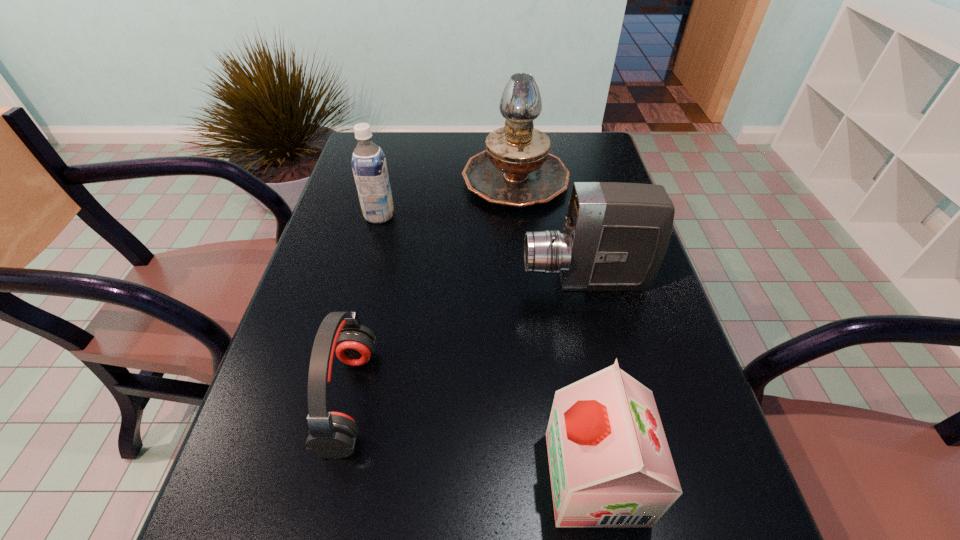
The height and width of the screenshot is (540, 960). In order to click on oil lamp in this screenshot , I will do `click(516, 170)`.

Find the location of `the farther soya milk`. the farther soya milk is located at coordinates (368, 161).

At what (x,y) coordinates should I click in order to perform the action: click on camcorder. Please return your answer as a coordinate pair (x, y). The width and height of the screenshot is (960, 540). Looking at the image, I should click on (615, 236).

The image size is (960, 540). In order to click on the right soya milk in this screenshot , I will do [610, 465].

Locate an element on the screen. This screenshot has width=960, height=540. earphone is located at coordinates (332, 435).

The width and height of the screenshot is (960, 540). Identify the location of blank area located on the front of the oil lamp. (529, 319).

Find the location of `free space located 0.220m on the label of the left soya milk`. free space located 0.220m on the label of the left soya milk is located at coordinates (476, 215).

The image size is (960, 540). In order to click on free space located 0.390m at the front of the camcorder, highlighting the lens in this screenshot , I will do pos(352,281).

I want to click on vacant space situated at the front of the camcorder, highlighting the lens, so click(x=352, y=281).

Locate an element on the screen. vacant region located 0.360m at the front of the camcorder, highlighting the lens is located at coordinates (366, 281).